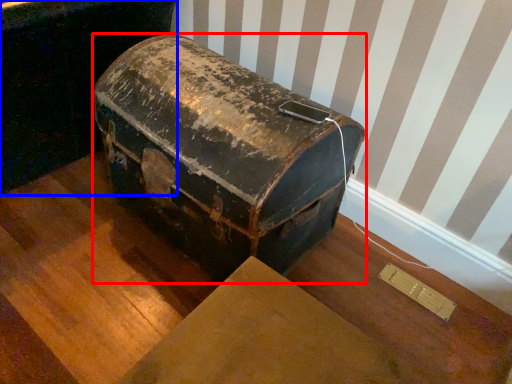
Question: Which object appears farthest to the camera in this image, suitcase (highlighted by a red box) or furniture (highlighted by a blue box)?

Choices:
 (A) suitcase
 (B) furniture

Answer: (B)